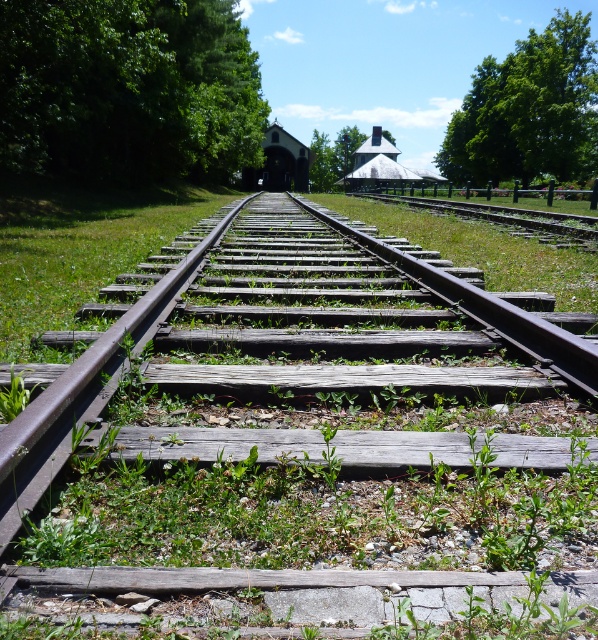
Question: Does green leafy tree at upper right have a greater width compared to green matte tree at upper center?

Choices:
 (A) no
 (B) yes

Answer: (B)

Question: Which point is farther from the camera taking this photo?

Choices:
 (A) (202, 508)
 (B) (440, 163)
 (C) (29, 115)
 (D) (318, 164)

Answer: (B)

Question: Which point is closer to the camera taking this photo?

Choices:
 (A) (343, 173)
 (B) (203, 540)
 (C) (54, 6)

Answer: (B)

Question: Considering the real-world distances, which object is closest to the green leafy tree at upper left?

Choices:
 (A) green matte tree at upper center
 (B) green leafy tree at upper right
 (C) weathered wood train track at center

Answer: (B)

Question: Is weathered wood train track at center below green matte tree at upper center?

Choices:
 (A) yes
 (B) no

Answer: (A)

Question: Is weathered wood train track at center above green leafy tree at upper left?

Choices:
 (A) no
 (B) yes

Answer: (A)